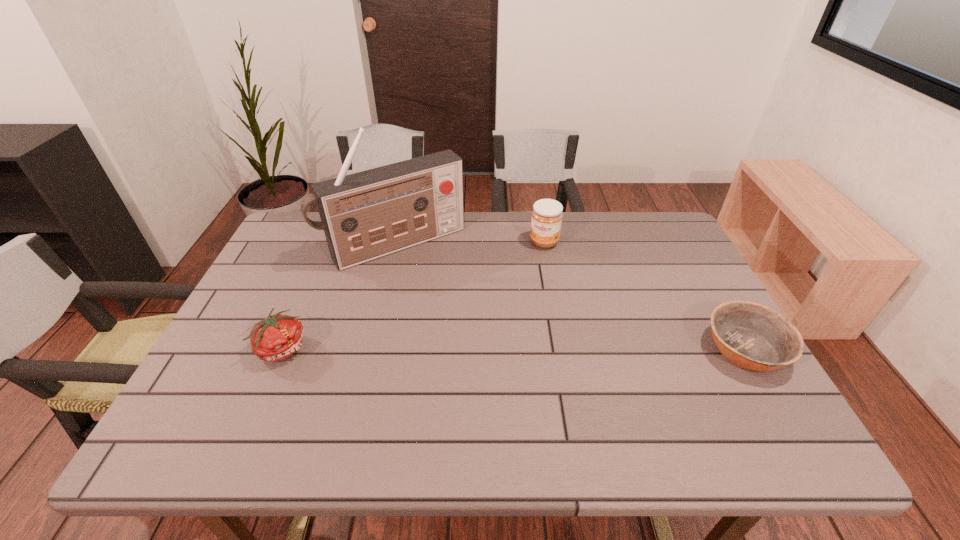
This screenshot has height=540, width=960. I want to click on free spot between the rightmost object and the second tallest object, so click(x=644, y=296).

Locate an element on the screen. This screenshot has width=960, height=540. free point between the second shortest object and the radio receiver is located at coordinates (339, 296).

Locate an element on the screen. empty space between the tomato and the third shortest object is located at coordinates (414, 295).

I want to click on vacant region between the rightmost object and the third tallest object, so click(514, 349).

Find the location of a particular element. The height and width of the screenshot is (540, 960). free spot between the jam and the tallest object is located at coordinates (470, 243).

Find the location of a particular element. This screenshot has width=960, height=540. free space between the jam and the tallest object is located at coordinates (470, 243).

The image size is (960, 540). In order to click on blank region between the third tallest object and the radio receiver in this screenshot , I will do `click(339, 296)`.

Where is `free spot between the radio receiver and the tomato`? This screenshot has height=540, width=960. free spot between the radio receiver and the tomato is located at coordinates (339, 296).

Image resolution: width=960 pixels, height=540 pixels. What are the coordinates of `unoccupied position between the third object from left to right and the tallest object` in the screenshot? It's located at (470, 243).

Identify which object is the third closest to the tomato. Please provide its 2D coordinates. Your answer should be formatted as a tuple, i.e. [(x, y)], where the tuple contains the x and y coordinates of a point satisfying the conditions above.

[(754, 337)]